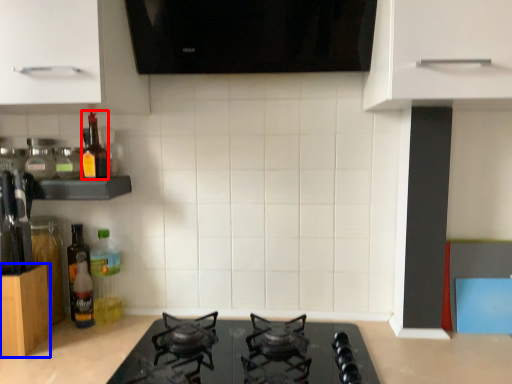
Question: Which object is closer to the camera taking this photo, bottle (highlighted by a red box) or cabinetry (highlighted by a blue box)?

Choices:
 (A) bottle
 (B) cabinetry

Answer: (B)